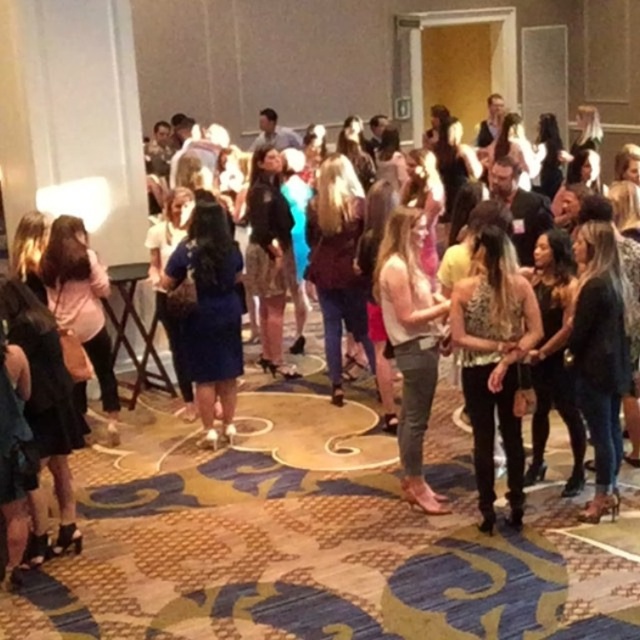
Describe the element at coordinates (493, 360) in the screenshot. I see `leopard print top at center` at that location.

Can you confirm if leopard print top at center is shorter than denim jeans at center?

Yes, leopard print top at center is shorter than denim jeans at center.

Between point (502, 305) and point (394, 272), which one is positioned in front?

Point (502, 305) is in front.

The height and width of the screenshot is (640, 640). Find the location of `leopard print top at center`. leopard print top at center is located at coordinates (493, 360).

Is blue satin dress at center thinner than denim jeans at center?

No, blue satin dress at center is not thinner than denim jeans at center.

You are a GUI agent. You are given a task and a screenshot of the screen. Output one action in this format:
    pyautogui.click(x=<x>, y=<y>)
    Task: Click on the blue satin dress at center
    
    Given the screenshot: What is the action you would take?
    pyautogui.click(x=209, y=314)

Which is behind, point (529, 324) or point (212, 406)?

Point (212, 406)

Which of these two, leopard print top at center or blue satin dress at center, stands shorter?

Standing shorter between the two is leopard print top at center.

I want to click on leopard print top at center, so click(x=493, y=360).

Where is `leopard print top at center`? The height and width of the screenshot is (640, 640). leopard print top at center is located at coordinates (493, 360).